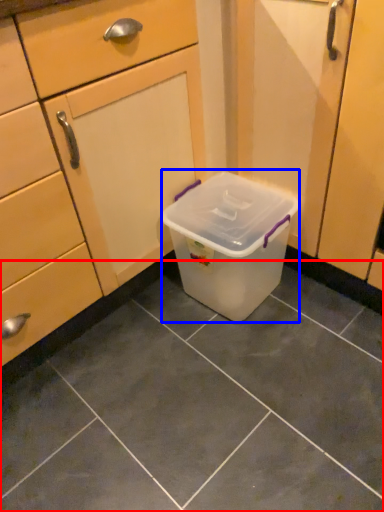
Question: Which of the following is the closest to the observer, tile (highlighted by a red box) or storage box (highlighted by a blue box)?

Choices:
 (A) tile
 (B) storage box

Answer: (A)